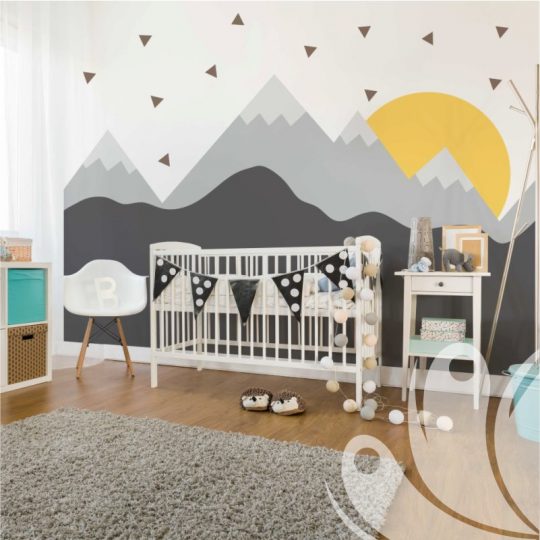
Where is `chair`? The image size is (540, 540). chair is located at coordinates (121, 289).